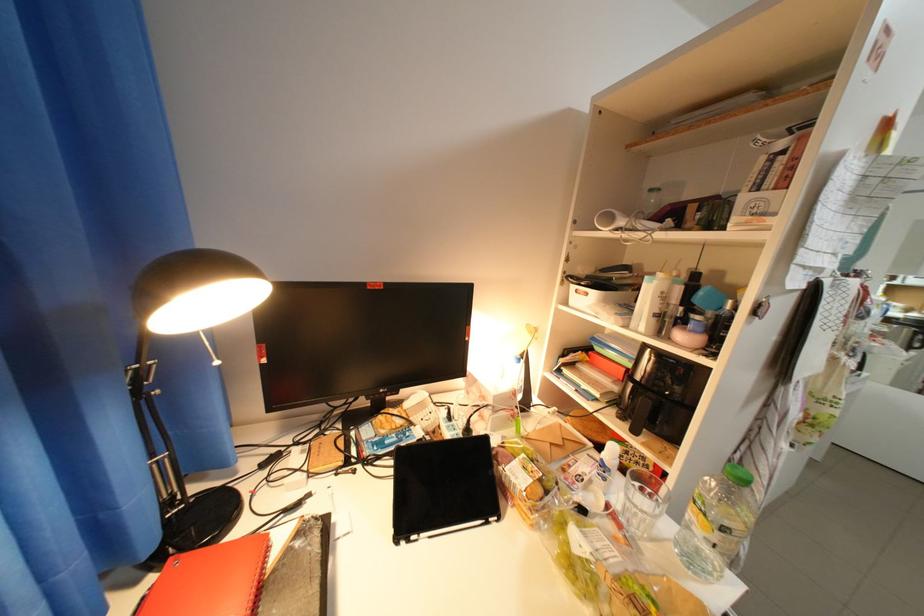
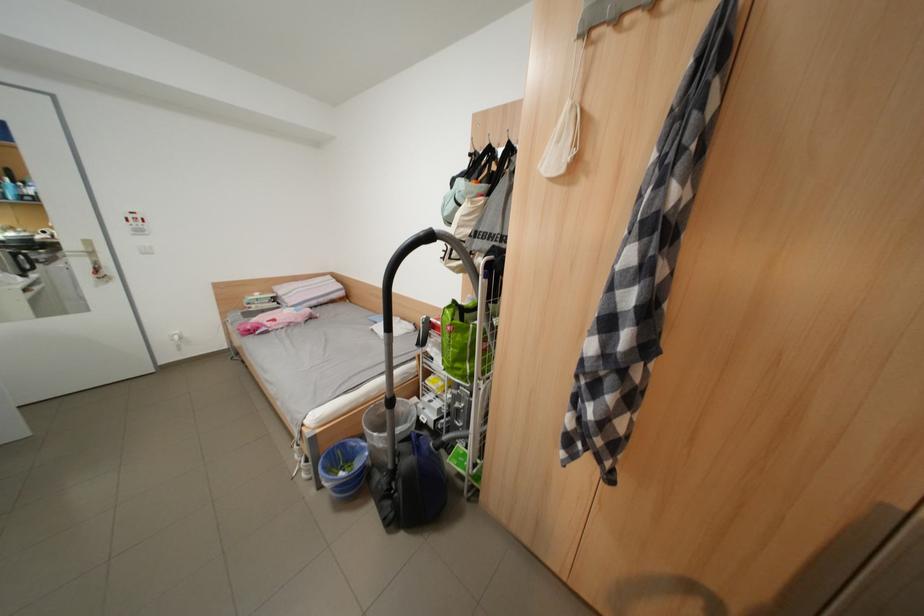
First-person continuous shooting, in which direction is the camera rotating?

The rotation direction of the camera is right-down.